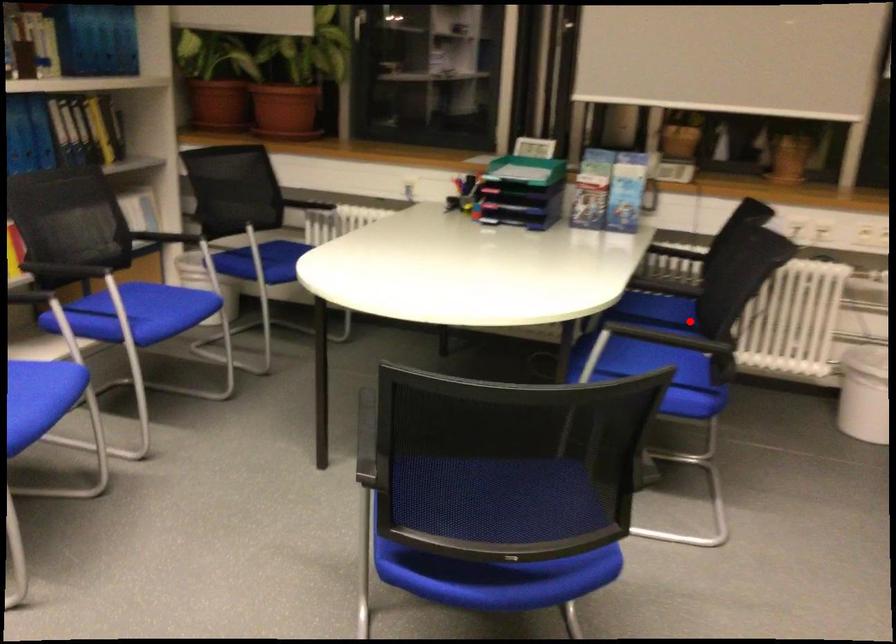
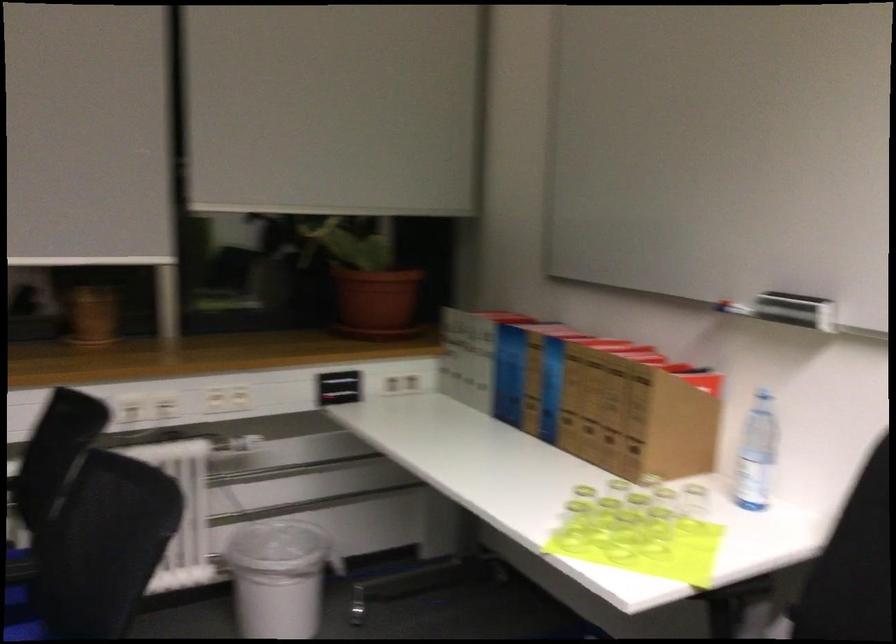
Locate, in the second image, the point that corresponds to the highlighted location in the first image.

(23, 603)